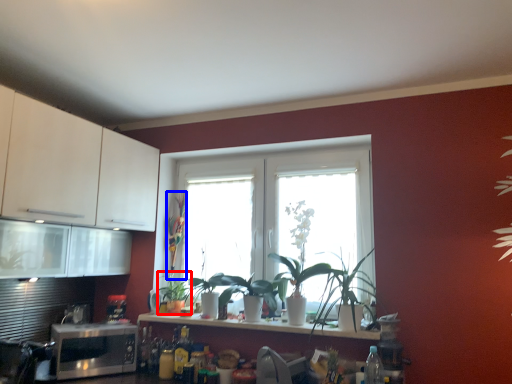
Question: Among these objects, which one is nearest to the camera, plant (highlighted by a red box) or plant (highlighted by a blue box)?

Choices:
 (A) plant
 (B) plant

Answer: (A)